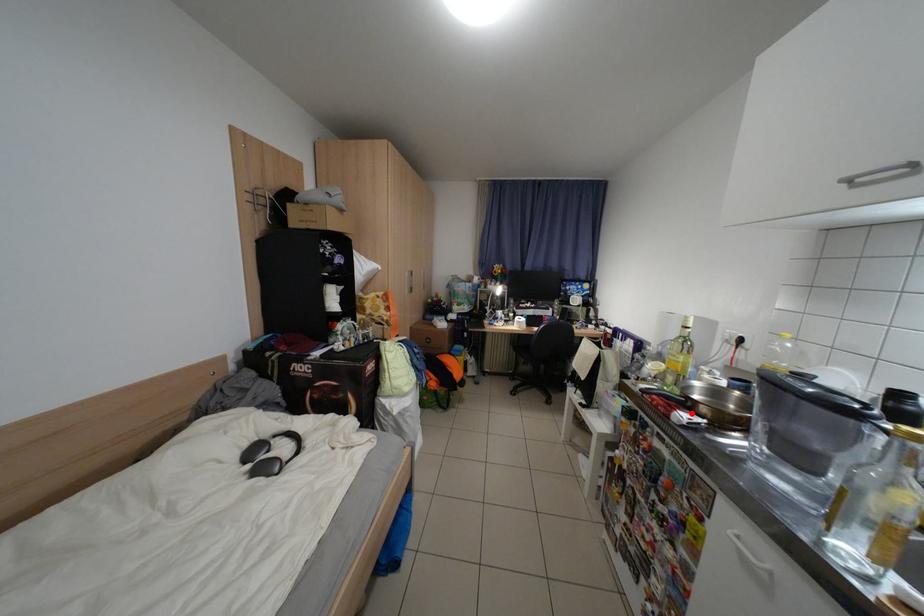
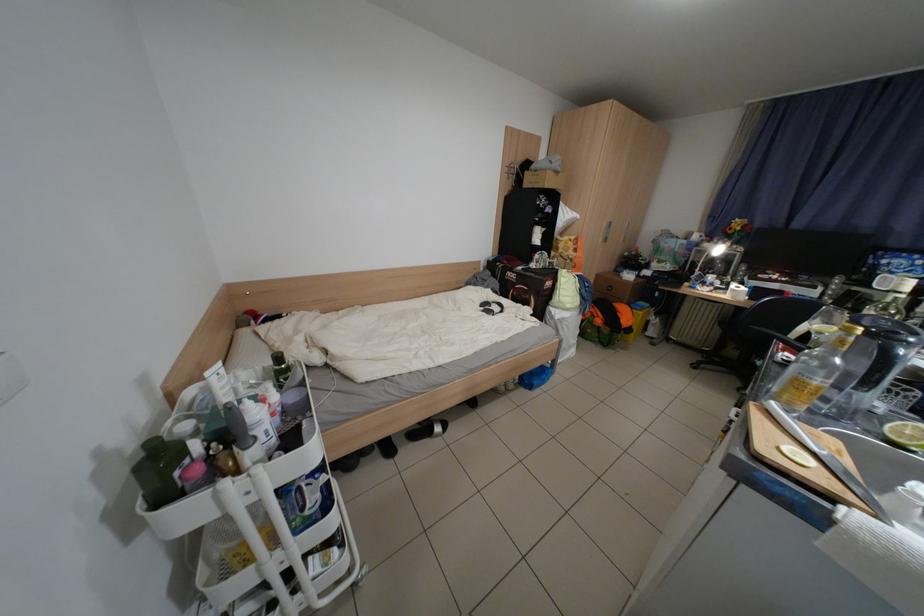
Question: I am providing you with two images of the same scene from different viewpoints. In image1, a red point is highlighted. Considering the same 3D point in image2, which of the following is correct?

Choices:
 (A) It is closer
 (B) It is farther

Answer: (B)